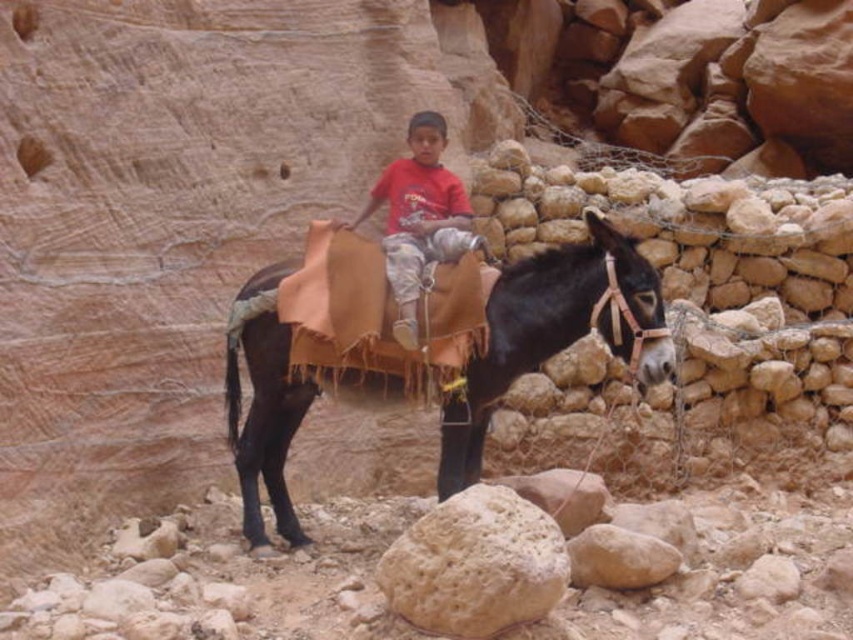
You are a hiker who has just arrived at the scene. You need to place a marker at the point labeled point [474,564]. Where exactly should you place it?

Place the marker on the smooth beige rock at lower center where point [474,564] is located.

You are a photographer trying to capture the scene with a camera. You notice the matte red shirt at center and the smooth beige rock at center. Which object should you focus on first if you want to ensure both are in sharp focus, given that your camera can only focus on one subject at a time?

The matte red shirt at center is much taller than the smooth beige rock at center. To ensure both are in sharp focus, you should focus on the matte red shirt at center first because it is larger and more prominent in the scene.